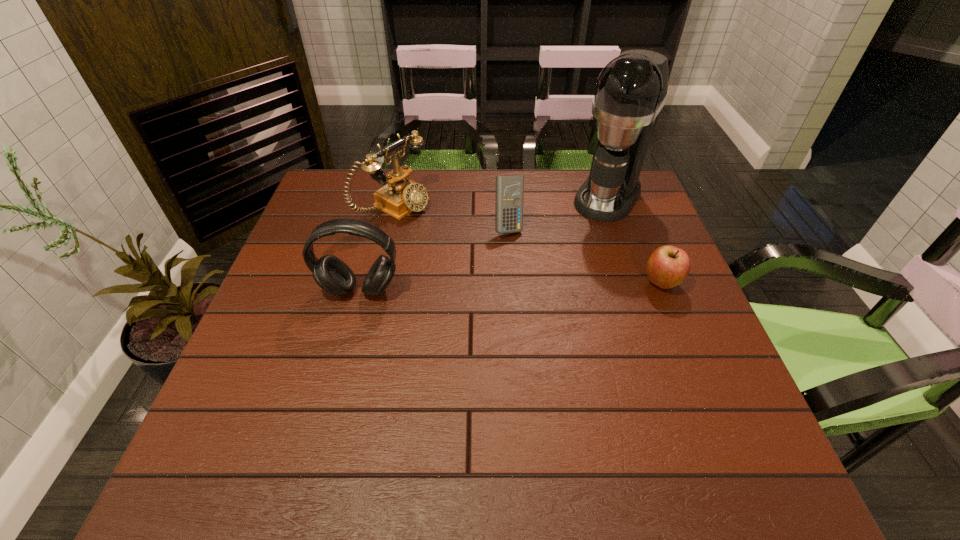
Identify the location of vacant position located on the dial number of the telephone. (527, 279).

Image resolution: width=960 pixels, height=540 pixels. What are the coordinates of `vacant space located on the front-facing side of the calculator` in the screenshot? It's located at (542, 296).

Locate an element on the screen. The width and height of the screenshot is (960, 540). free space located on the front-facing side of the calculator is located at coordinates coord(522,258).

You are a GUI agent. You are given a task and a screenshot of the screen. Output one action in this format:
    pyautogui.click(x=<x>, y=<y>)
    Task: Click on the blank space located 0.260m on the front-facing side of the calculator
    This screenshot has height=540, width=960.
    Given the screenshot: What is the action you would take?
    pyautogui.click(x=548, y=308)

What are the coordinates of `free region located 0.240m place cup under the spout of the coffee maker` in the screenshot? It's located at (564, 268).

The image size is (960, 540). Find the location of `vacant space located 0.150m place cup under the spout of the coffee maker`. vacant space located 0.150m place cup under the spout of the coffee maker is located at coordinates (577, 248).

Image resolution: width=960 pixels, height=540 pixels. Find the location of `vacant space located place cup under the spout of the coffee maker`. vacant space located place cup under the spout of the coffee maker is located at coordinates (543, 298).

Find the location of a particular element. telephone located at the far edge is located at coordinates (401, 196).

Where is `coffee maker situated at the far edge`? This screenshot has width=960, height=540. coffee maker situated at the far edge is located at coordinates (631, 90).

I want to click on headset positioned at the left edge, so click(335, 277).